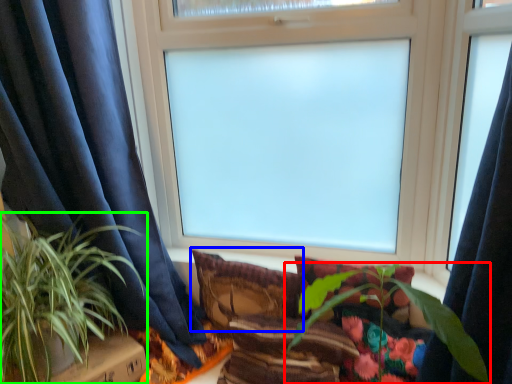
Question: Which object is positioned closest to houseplant (highlighted by a red box)? Select from pillow (highlighted by a blue box) and houseplant (highlighted by a green box).

Choices:
 (A) pillow
 (B) houseplant

Answer: (A)